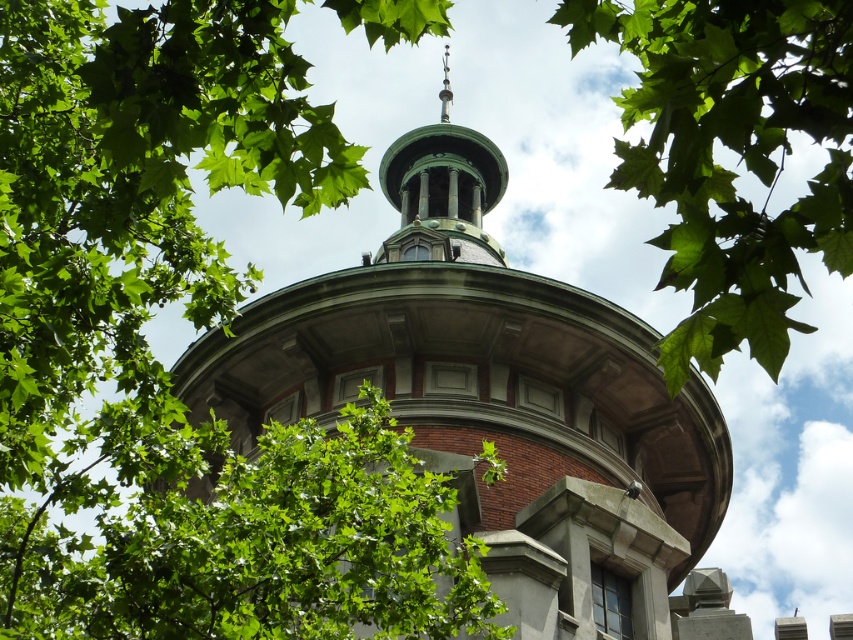
In the scene shown: Does green polished dome at center have a greater width compared to green leafy tree at upper center?

Indeed, green polished dome at center has a greater width compared to green leafy tree at upper center.

Does green polished dome at center have a greater height compared to green leafy tree at upper center?

Yes, green polished dome at center is taller than green leafy tree at upper center.

Between point (537, 522) and point (845, 138), which one is positioned behind?

The point (537, 522) is behind.

Identify the location of green polished dome at center. This screenshot has width=853, height=640. (498, 403).